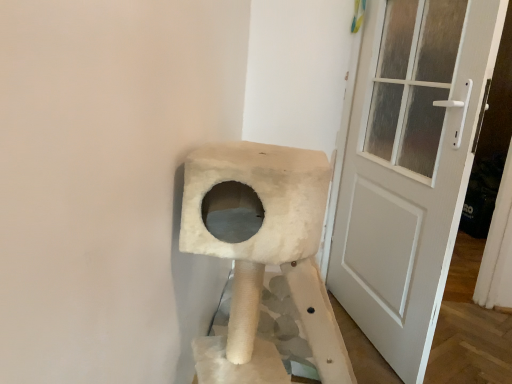
Where is `white textured door at right`? The height and width of the screenshot is (384, 512). white textured door at right is located at coordinates (409, 166).

The width and height of the screenshot is (512, 384). Describe the element at coordinates (409, 166) in the screenshot. I see `white textured door at right` at that location.

In order to face white fluffy cat furniture at center, should I rotate leftwards or rightwards?

Turn right approximately 5.636 degrees to face it.

What do you see at coordinates (263, 260) in the screenshot? I see `white fluffy cat furniture at center` at bounding box center [263, 260].

At what (x,y) coordinates should I click in order to perform the action: click on white fluffy cat furniture at center. Please return your answer as a coordinate pair (x, y). Looking at the image, I should click on (263, 260).

The width and height of the screenshot is (512, 384). I want to click on white textured door at right, so click(409, 166).

Which object is positioned more to the right, white fluffy cat furniture at center or white textured door at right?

white textured door at right is more to the right.

Is white fluffy cat furniture at center further to camera compared to white textured door at right?

No.

Does point (196, 203) lie behind point (412, 51)?

That is False.

From the image's perspective, is white fluffy cat furniture at center located above white textured door at right?

No, from the image's perspective, white fluffy cat furniture at center is not over white textured door at right.

From a real-world perspective, is white fluffy cat furniture at center positioned above or below white textured door at right?

Clearly, from a real-world perspective, white fluffy cat furniture at center is below white textured door at right.

Does white fluffy cat furniture at center have a greater width compared to white textured door at right?

Yes, white fluffy cat furniture at center is wider than white textured door at right.

Considering the sizes of objects white fluffy cat furniture at center and white textured door at right in the image provided, who is shorter, white fluffy cat furniture at center or white textured door at right?

Standing shorter between the two is white fluffy cat furniture at center.

In terms of size, does white fluffy cat furniture at center appear bigger or smaller than white textured door at right?

Clearly, white fluffy cat furniture at center is larger in size than white textured door at right.

Is white textured door at right located within white fluffy cat furniture at center?

No, white textured door at right is not inside white fluffy cat furniture at center.

Is white fluffy cat furniture at center placed right next to white textured door at right?

No, white fluffy cat furniture at center is not beside white textured door at right.

Is white textured door at right at the back of white fluffy cat furniture at center?

No, white fluffy cat furniture at center is not facing away from white textured door at right.

What's the angular difference between white fluffy cat furniture at center and white textured door at right's facing directions?

20.2 degrees separate the facing orientations of white fluffy cat furniture at center and white textured door at right.

Locate an element on the screen. This screenshot has height=384, width=512. door on the right of white fluffy cat furniture at center is located at coordinates (409, 166).

Visually, is white textured door at right positioned to the left or to the right of white fluffy cat furniture at center?

Clearly, white textured door at right is on the right of white fluffy cat furniture at center in the image.

Which is behind, white textured door at right or white fluffy cat furniture at center?

white textured door at right is further from the camera.

Does point (441, 280) come behind point (239, 317)?

Yes, it is behind point (239, 317).

From the image's perspective, does white textured door at right appear lower than white fluffy cat furniture at center?

Incorrect, from the image's perspective, white textured door at right is higher than white fluffy cat furniture at center.

Looking at this image, from a real-world perspective, is white textured door at right on top of white fluffy cat furniture at center?

Correct, in the physical world, white textured door at right is higher than white fluffy cat furniture at center.

Is white textured door at right thinner than white fluffy cat furniture at center?

Yes, white textured door at right is thinner than white fluffy cat furniture at center.

Can you confirm if white textured door at right is taller than white fluffy cat furniture at center?

Yes.

Can you confirm if white textured door at right is smaller than white fluffy cat furniture at center?

Correct, white textured door at right occupies less space than white fluffy cat furniture at center.

Can white fluffy cat furniture at center be found inside white textured door at right?

No, white textured door at right does not contain white fluffy cat furniture at center.

Is there a large distance between white textured door at right and white fluffy cat furniture at center?

That's not correct — white textured door at right is a little close to white fluffy cat furniture at center.

Consider the image. Is white textured door at right turned away from white fluffy cat furniture at center?

Yes, white textured door at right's orientation is away from white fluffy cat furniture at center.

How many degrees apart are the facing directions of white textured door at right and white fluffy cat furniture at center?

There is a 20.2-degree angle between the facing directions of white textured door at right and white fluffy cat furniture at center.

Where is `cat furniture that is under the white textured door at right (from a real-world perspective)`? cat furniture that is under the white textured door at right (from a real-world perspective) is located at coordinates (263, 260).

Where is `cat furniture that appears in front of the white textured door at right`? Image resolution: width=512 pixels, height=384 pixels. cat furniture that appears in front of the white textured door at right is located at coordinates (263, 260).

Find the location of a particular element. door located on the right of white fluffy cat furniture at center is located at coordinates [409, 166].